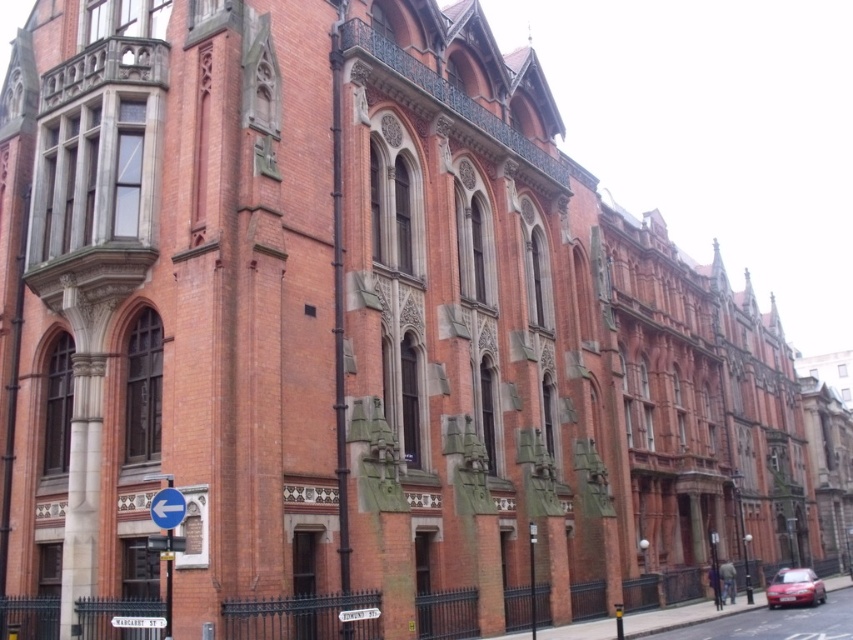
Question: Does shiny red car at lower right appear on the left side of blue plastic arrow at lower left?

Choices:
 (A) yes
 (B) no

Answer: (B)

Question: Which object appears closest to the camera in this image?

Choices:
 (A) shiny red car at lower right
 (B) blue plastic arrow at lower left

Answer: (B)

Question: Which point is farther to the camera?

Choices:
 (A) (767, 600)
 (B) (157, 506)

Answer: (A)

Question: Can you confirm if shiny red car at lower right is wider than blue plastic arrow at lower left?

Choices:
 (A) yes
 (B) no

Answer: (A)

Question: Which point is farther to the camera?

Choices:
 (A) shiny red car at lower right
 (B) blue plastic arrow at lower left

Answer: (A)

Question: Can you confirm if shiny red car at lower right is positioned above blue plastic arrow at lower left?

Choices:
 (A) yes
 (B) no

Answer: (B)